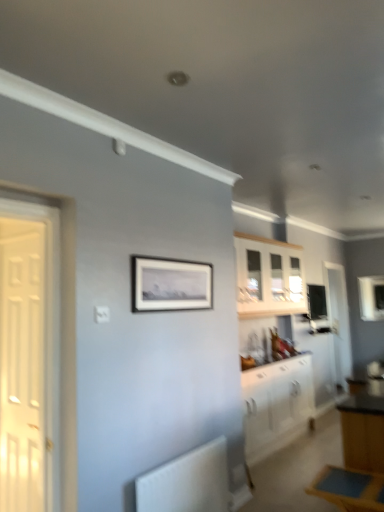
Locate an element on the screen. The image size is (384, 512). vacant point above white wooden door at left, which is the second door from right to left (from a real-world perspective) is located at coordinates (23, 229).